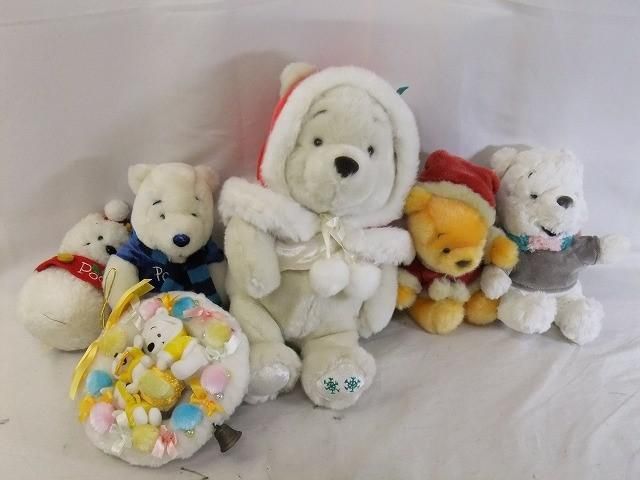
The width and height of the screenshot is (640, 480). I want to click on plushie toys, so tap(554, 227), tap(464, 231), tap(342, 180), tap(173, 223), tap(97, 237), tap(236, 367).